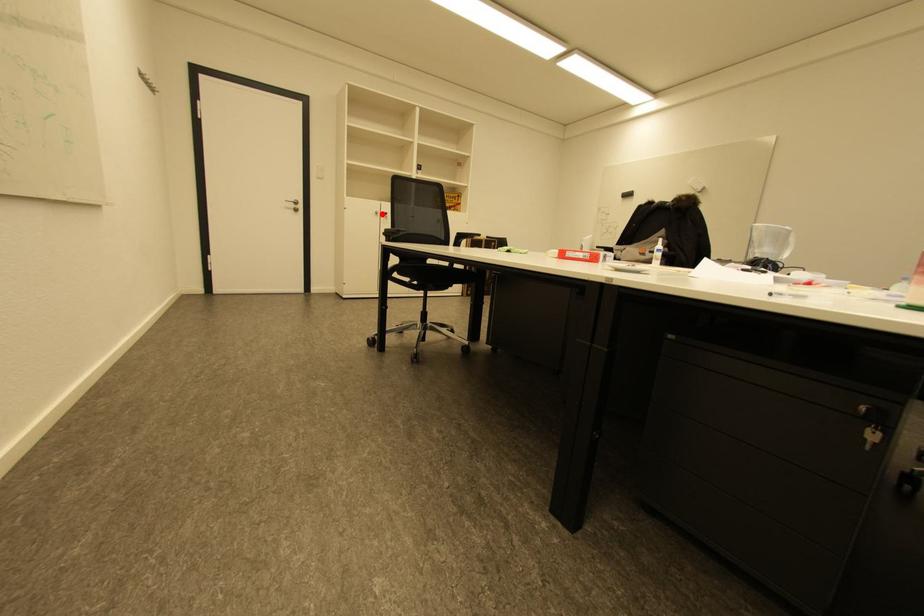
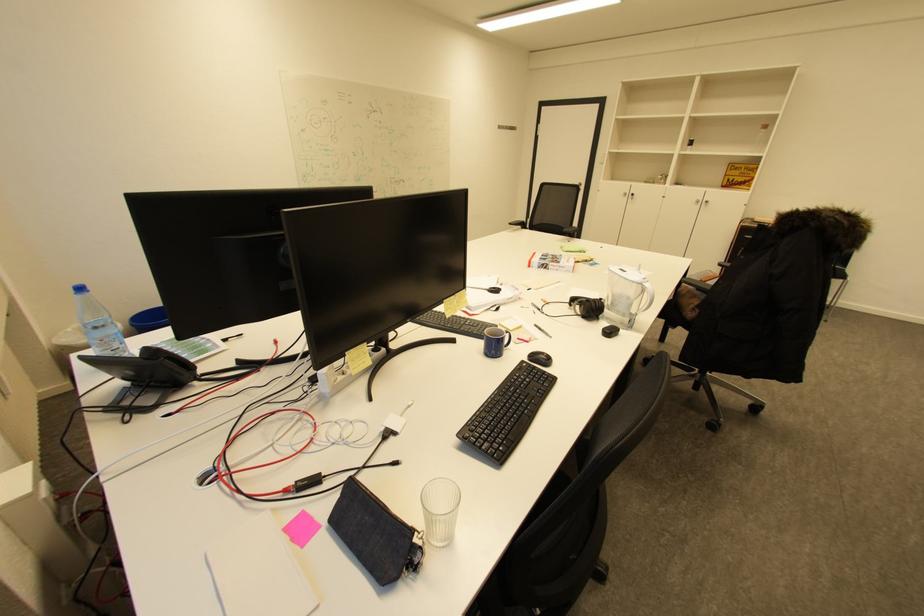
Find the pixel in the second image that matches the highlighted location in the first image.

(630, 195)